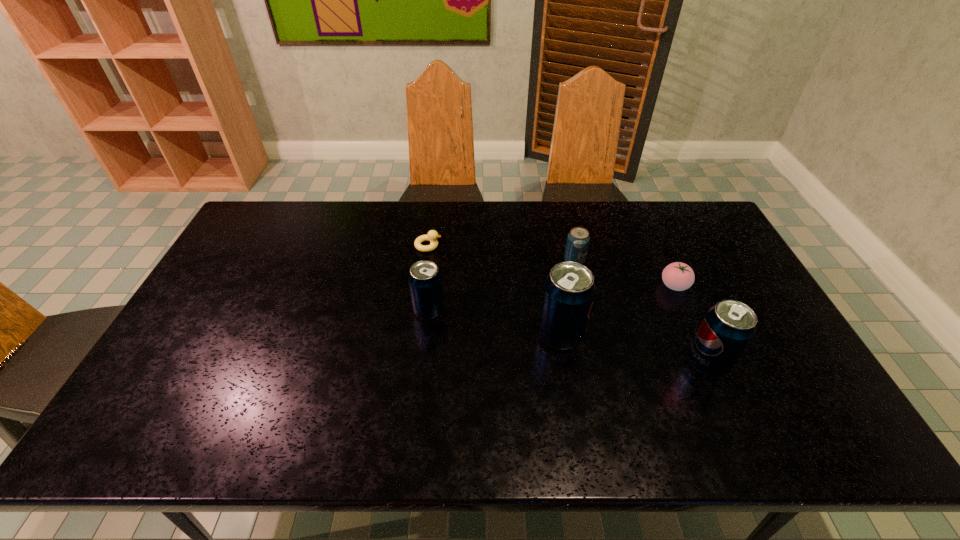
The height and width of the screenshot is (540, 960). Identify the location of vacant area at the far left corner. (261, 219).

Identify the location of vacant space at the far right corner. Image resolution: width=960 pixels, height=540 pixels. (708, 233).

The image size is (960, 540). I want to click on vacant area that lies between the leftmost pop soda and the third shortest object, so click(501, 286).

What are the coordinates of `vacant space that's between the farthest pop soda and the second shortest pop soda` in the screenshot? It's located at (501, 286).

Image resolution: width=960 pixels, height=540 pixels. I want to click on vacant area between the third farthest object and the duckling, so click(x=551, y=266).

Image resolution: width=960 pixels, height=540 pixels. I want to click on free space between the shortest pop soda and the tomato, so click(624, 274).

Where is `object that stands as the third closest to the tomato`? The image size is (960, 540). object that stands as the third closest to the tomato is located at coordinates (569, 290).

Find the location of `object that ranks as the fifth closest to the fifth nearest object`. object that ranks as the fifth closest to the fifth nearest object is located at coordinates (432, 235).

Identify which pop soda is located as the nearest to the fifth shortest object. Please provide its 2D coordinates. Your answer should be formatted as a tuple, i.e. [(x, y)], where the tuple contains the x and y coordinates of a point satisfying the conditions above.

[(569, 290)]

Select which pop soda is the second closest to the shortest object. Please provide its 2D coordinates. Your answer should be formatted as a tuple, i.e. [(x, y)], where the tuple contains the x and y coordinates of a point satisfying the conditions above.

[(578, 238)]